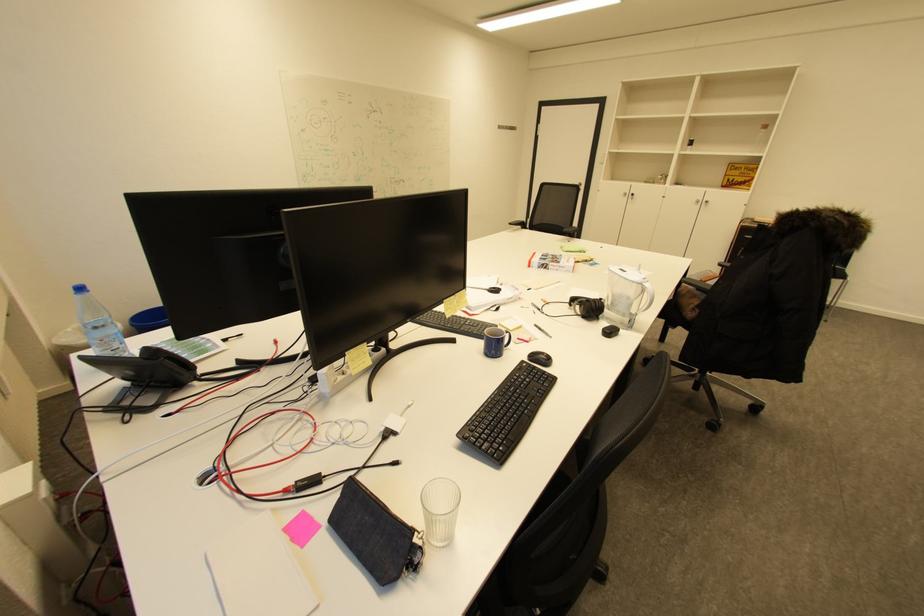
Where would you slid the black computer mouse? Please return your answer as a coordinate pair (x, y).

(540, 358)